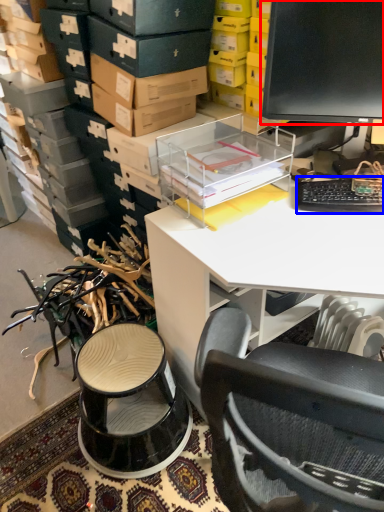
Question: Which point is further to the camera, computer monitor (highlighted by a red box) or computer keyboard (highlighted by a blue box)?

Choices:
 (A) computer monitor
 (B) computer keyboard

Answer: (B)